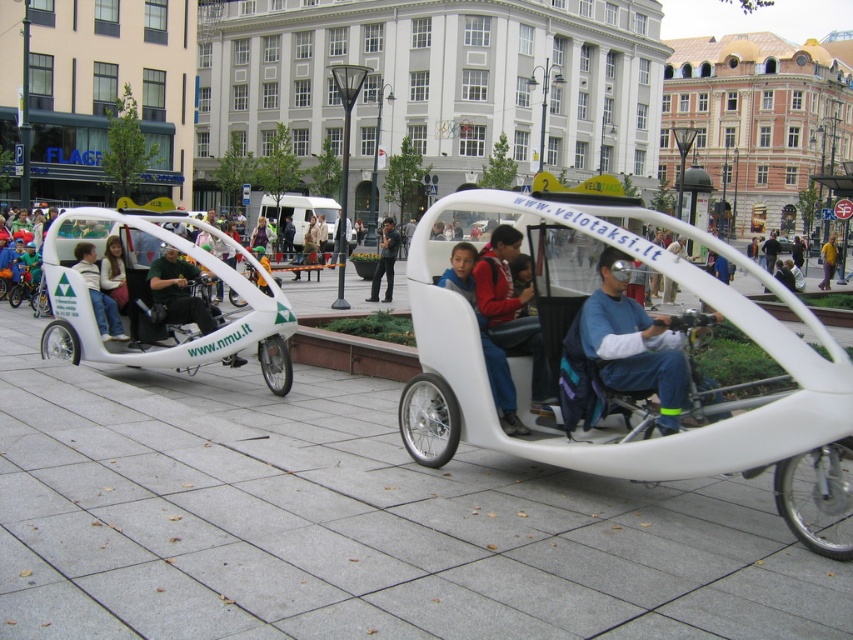
Question: Which object is the farthest from the yellow fabric jacket at center?

Choices:
 (A) white matte pedicab at left
 (B) red sweater at center
 (C) white matte pedicab at center

Answer: (C)

Question: Estimate the real-world distances between objects in this image. Which object is farther from the red sweater at center?

Choices:
 (A) dark blue jeans at center
 (B) yellow fabric jacket at center

Answer: (B)

Question: Is red sweater at center bigger than matte white jacket at center?

Choices:
 (A) no
 (B) yes

Answer: (A)

Question: Among these points, which one is farthest from the camera?

Choices:
 (A) (549, 385)
 (B) (195, 301)
 (C) (91, 292)

Answer: (C)

Question: Does white matte pedicab at center appear on the right side of red sweater at center?

Choices:
 (A) yes
 (B) no

Answer: (A)

Question: Is white matte pedicab at center bigger than white matte pedicab at left?

Choices:
 (A) yes
 (B) no

Answer: (A)